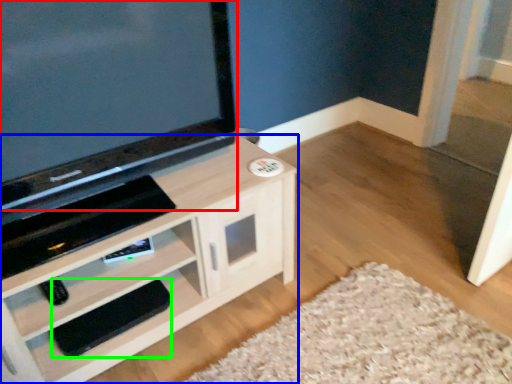
Question: Based on their relative distances, which object is nearer to television (highlighted by a red box)? Choose from cabinetry (highlighted by a blue box) and footrest (highlighted by a green box).

Choices:
 (A) cabinetry
 (B) footrest

Answer: (A)